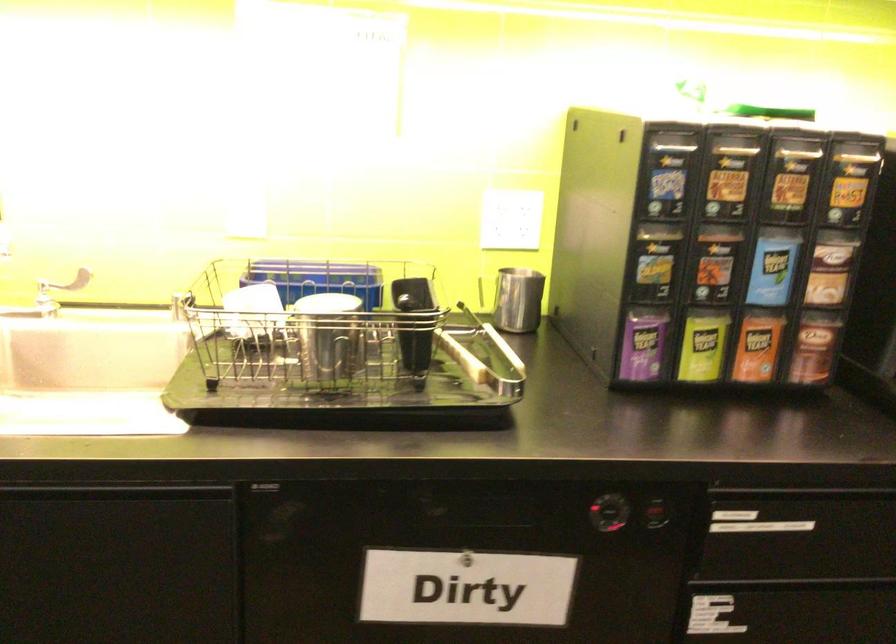
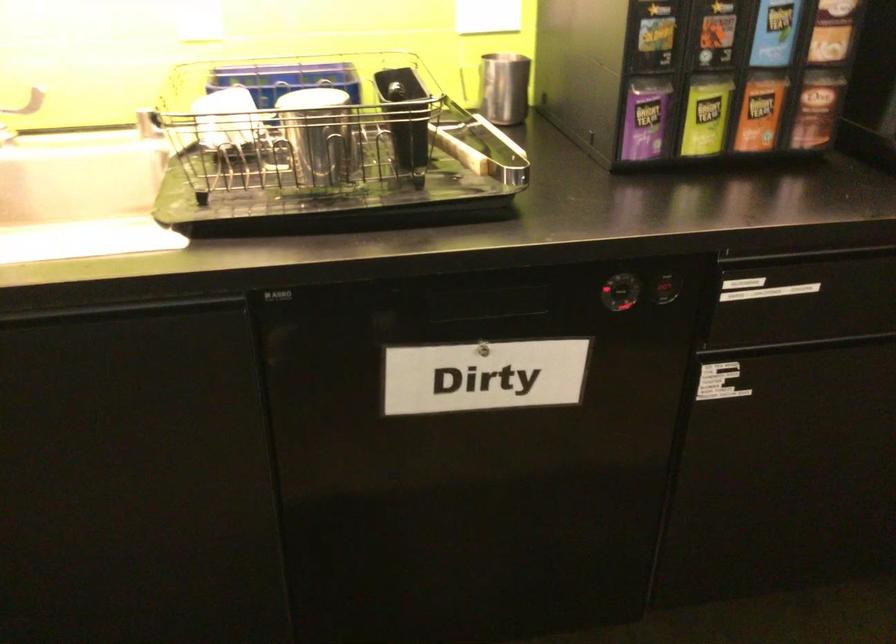
Find the pixel in the second image that matches (755,346) in the first image.

(760, 111)